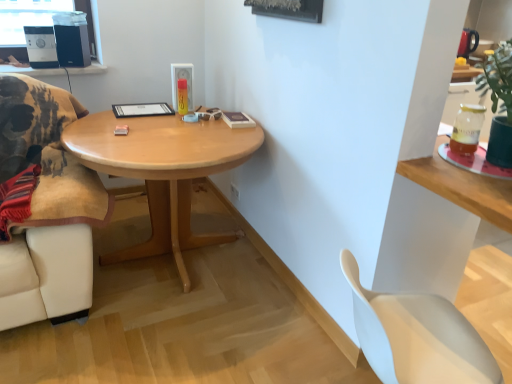
Question: Should I look upward or downward to see white plastic chair at lower right?

Choices:
 (A) down
 (B) up

Answer: (A)

Question: From the image's perspective, is translucent glass jar at upper right under white plastic chair at lower right?

Choices:
 (A) no
 (B) yes

Answer: (A)

Question: Does translucent glass jar at upper right have a greater width compared to white plastic chair at lower right?

Choices:
 (A) yes
 (B) no

Answer: (B)

Question: From a real-world perspective, is translucent glass jar at upper right below white plastic chair at lower right?

Choices:
 (A) yes
 (B) no

Answer: (B)

Question: Can you confirm if translucent glass jar at upper right is positioned to the left of white plastic chair at lower right?

Choices:
 (A) no
 (B) yes

Answer: (A)

Question: Does translucent glass jar at upper right have a lesser height compared to white plastic chair at lower right?

Choices:
 (A) no
 (B) yes

Answer: (B)

Question: Is translucent glass jar at upper right located outside white plastic chair at lower right?

Choices:
 (A) yes
 (B) no

Answer: (A)

Question: Is black matte speaker at upper left, which is the first speaker from right to left, closer to camera compared to translucent glass jar at upper right?

Choices:
 (A) yes
 (B) no

Answer: (B)

Question: Is black matte speaker at upper left, positioned as the 2th speaker in left-to-right order, surrounding translucent glass jar at upper right?

Choices:
 (A) no
 (B) yes

Answer: (A)

Question: From a real-world perspective, does black matte speaker at upper left, positioned as the 2th speaker in left-to-right order, sit lower than translucent glass jar at upper right?

Choices:
 (A) no
 (B) yes

Answer: (A)

Question: Is black matte speaker at upper left, which is the first speaker from right to left, oriented away from translucent glass jar at upper right?

Choices:
 (A) no
 (B) yes

Answer: (A)

Question: Can you confirm if black matte speaker at upper left, which is the first speaker from right to left, is positioned to the left of translucent glass jar at upper right?

Choices:
 (A) yes
 (B) no

Answer: (A)

Question: From the image's perspective, is black matte speaker at upper left, positioned as the 2th speaker in left-to-right order, beneath translucent glass jar at upper right?

Choices:
 (A) yes
 (B) no

Answer: (B)

Question: Does matte black speaker at upper left, the 1th speaker viewed from the left, contain translucent glass jar at upper right?

Choices:
 (A) no
 (B) yes

Answer: (A)